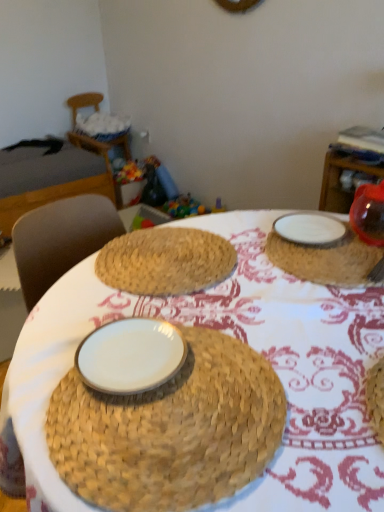
Question: Do you think dark gray fabric bed at left is within white woven basket at upper left, or outside of it?

Choices:
 (A) inside
 (B) outside

Answer: (B)

Question: Looking at their shapes, would you say dark gray fabric bed at left is wider or thinner than white woven basket at upper left?

Choices:
 (A) wide
 (B) thin

Answer: (A)

Question: Which of these objects is positioned closest to the translucent plastic toy at center?

Choices:
 (A) white woven basket at upper left
 (B) white glossy plate at center, marked as the first plate in a left-to-right arrangement
 (C) woven straw placemat at center
 (D) dark gray fabric bed at left
 (E) white ceramic plate at upper right

Answer: (D)

Question: Estimate the real-world distances between objects in this image. Which object is closer to the translucent plastic toy at center?

Choices:
 (A) white matte plate at upper right, the first plate when ordered from top to bottom
 (B) woven straw placemat at center
 (C) white woven basket at upper left
 (D) dark gray fabric bed at left
 (E) white glossy plate at center, the 2th plate viewed from the right

Answer: (D)